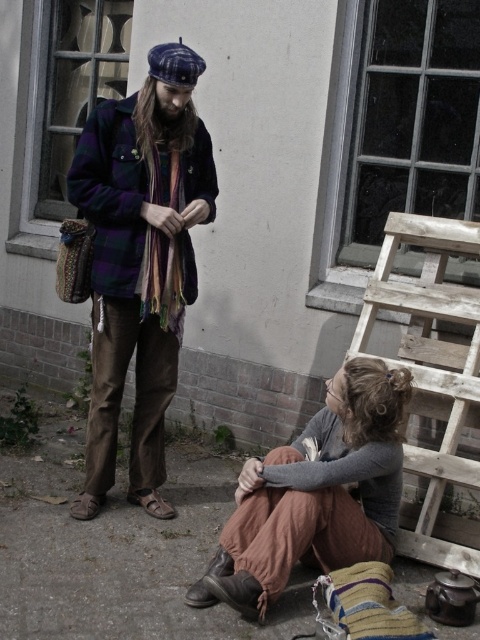
You are standing 10 feet away from the camera. You want to reach the plaid woolen jacket at center without moving closer than 1 foot from your current position. Is it possible?

The plaid woolen jacket at center is 9.71 feet away from the camera. Since you are currently 10 feet away, you can move 0.29 feet closer to reach it while staying at least 1 foot away from your starting position. Therefore, it is possible.

You are a fashion designer observing the scene. You notice the plaid woolen jacket at center and the rustic brown pants at lower center. Which clothing item is positioned higher in the image?

The plaid woolen jacket at center is above rustic brown pants at lower center, so the plaid woolen jacket at center is positioned higher in the image.